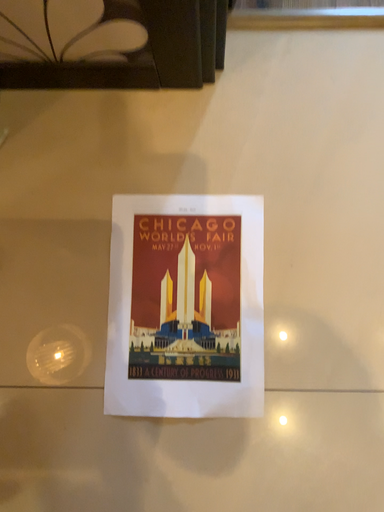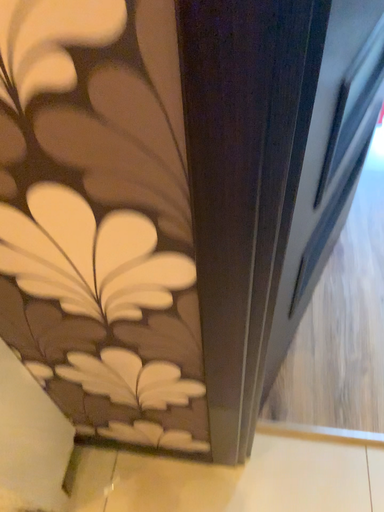
Question: Which way did the camera rotate in the video?

Choices:
 (A) rotated downward
 (B) rotated upward

Answer: (B)